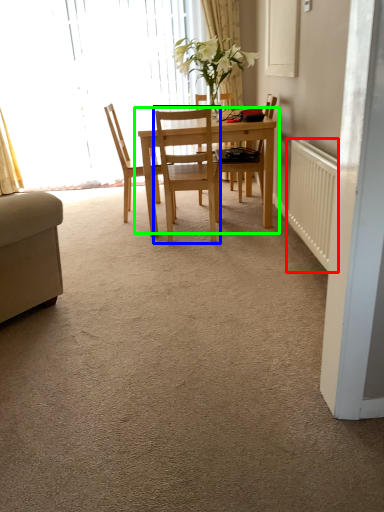
Question: Which object is positioned farthest from radiator (highlighted by a red box)? Select from chair (highlighted by a blue box) and kitchen & dining room table (highlighted by a green box).

Choices:
 (A) chair
 (B) kitchen & dining room table

Answer: (A)